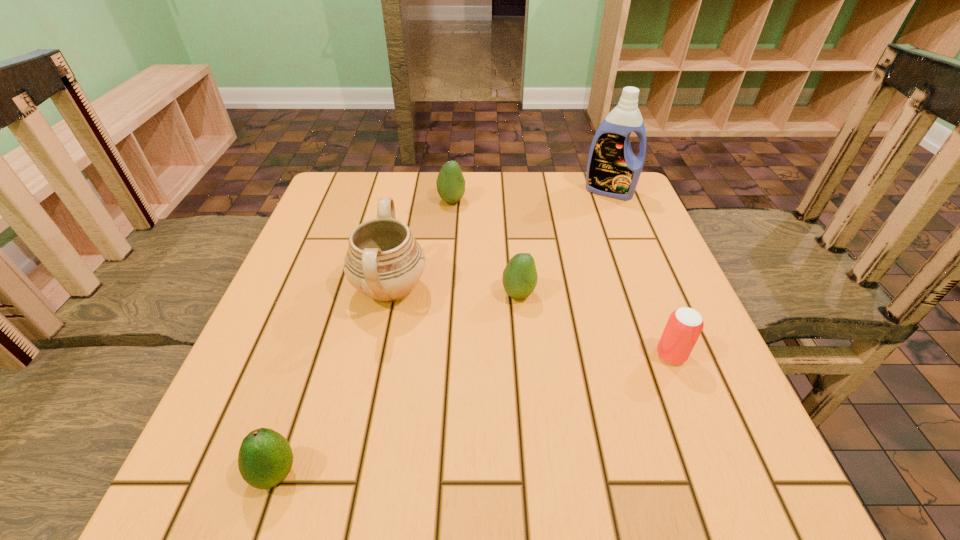
The height and width of the screenshot is (540, 960). I want to click on beer can that is at the right edge, so click(x=684, y=326).

At what (x,y) coordinates should I click in order to perform the action: click on object situated at the near left corner. Please return your answer as a coordinate pair (x, y). The height and width of the screenshot is (540, 960). Looking at the image, I should click on (265, 458).

Identify the location of object positioned at the far right corner. (613, 170).

Locate an element on the screen. This screenshot has width=960, height=540. blank space at the far edge is located at coordinates (533, 179).

Locate an element on the screen. Image resolution: width=960 pixels, height=540 pixels. free location at the near edge is located at coordinates (481, 476).

In the image, there is a desktop. What are the coordinates of `vacant space at the left edge` in the screenshot? It's located at coord(229,399).

Identify the location of blank area at the right edge. The height and width of the screenshot is (540, 960). (621, 284).

In the image, there is a desktop. Where is `vacant space at the far left corner`? The image size is (960, 540). vacant space at the far left corner is located at coordinates (355, 178).

Find the location of a particular element. This screenshot has height=540, width=960. blank space at the near left corner of the desktop is located at coordinates coord(268,499).

Find the location of a particular element. This screenshot has height=540, width=960. vacant space at the near right corner of the desktop is located at coordinates (690, 473).